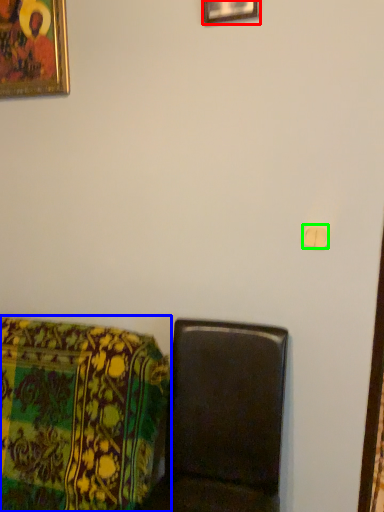
Question: Based on their relative distances, which object is farther from picture frame (highlighted by a red box)? Choose from furniture (highlighted by a blue box) and light switch (highlighted by a green box).

Choices:
 (A) furniture
 (B) light switch

Answer: (A)